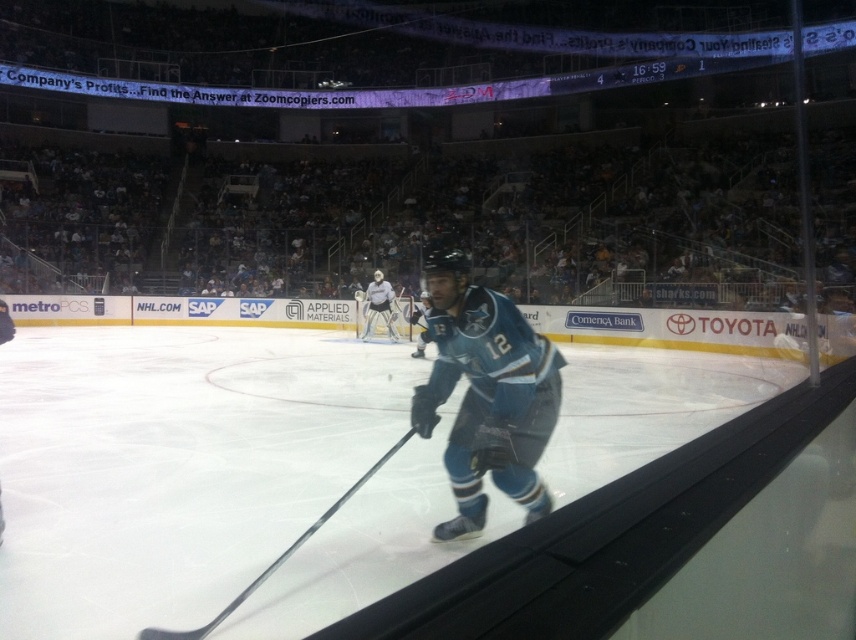
Question: Among these objects, which one is nearest to the camera?

Choices:
 (A) white matte goalie at center
 (B) teal jersey at center
 (C) metallic silver hockey stick at center

Answer: (C)

Question: Does teal jersey at center appear over white matte goalie at center?

Choices:
 (A) no
 (B) yes

Answer: (A)

Question: Based on their relative distances, which object is farther from the white matte goalie at center?

Choices:
 (A) metallic silver hockey stick at center
 (B) teal jersey at center

Answer: (A)

Question: Can you confirm if metallic silver hockey stick at center is wider than white matte goalie at center?

Choices:
 (A) yes
 (B) no

Answer: (B)

Question: Is teal jersey at center thinner than metallic silver hockey stick at center?

Choices:
 (A) no
 (B) yes

Answer: (A)

Question: Considering the real-world distances, which object is farthest from the metallic silver hockey stick at center?

Choices:
 (A) white matte goalie at center
 (B) teal jersey at center

Answer: (A)